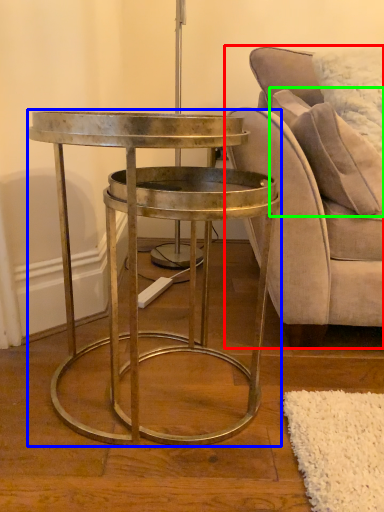
Question: Estimate the real-world distances between objects in this image. Which object is farther from chair (highlighted by a red box), table (highlighted by a blue box) or pillow (highlighted by a green box)?

Choices:
 (A) table
 (B) pillow

Answer: (A)